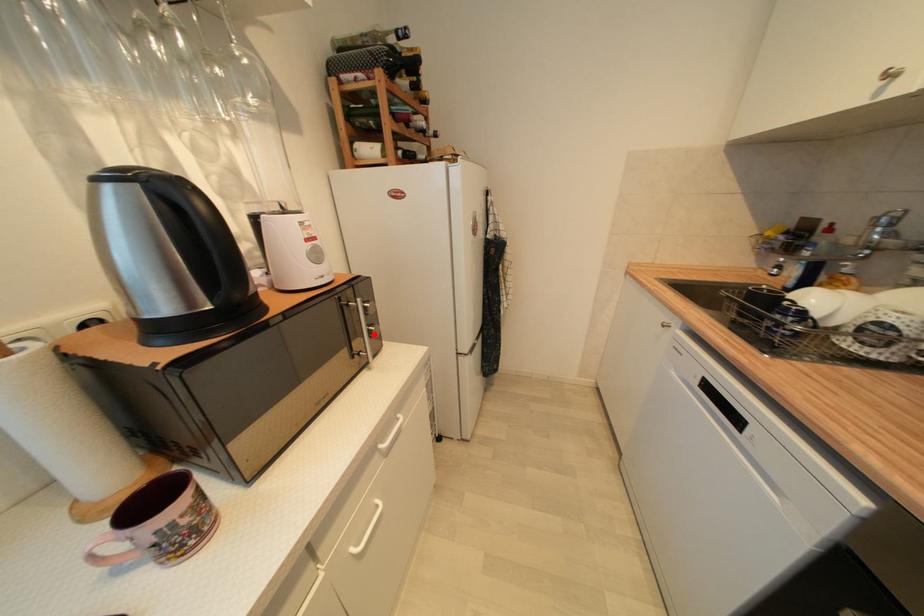
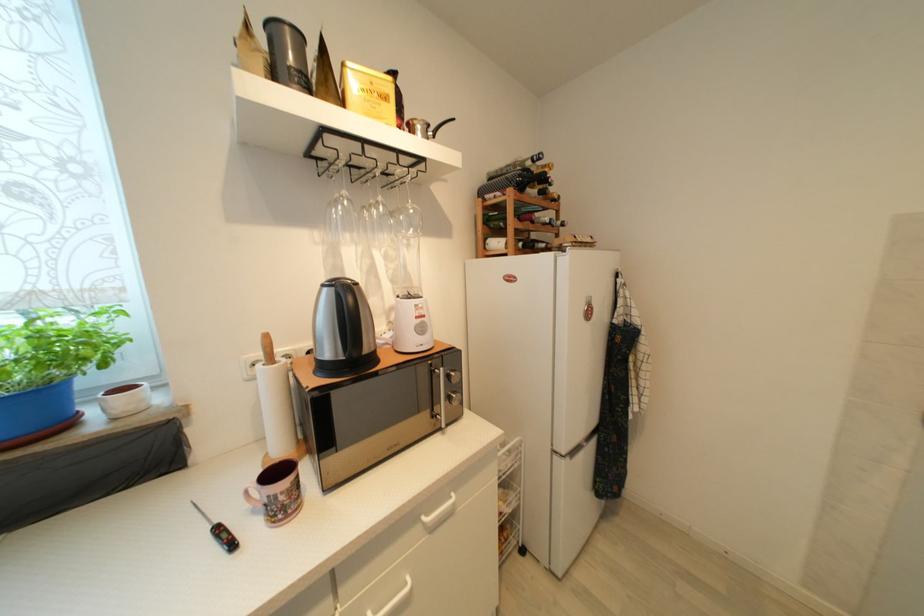
Locate, in the second image, the point that corresponds to the highlighted location in the first image.

(455, 400)